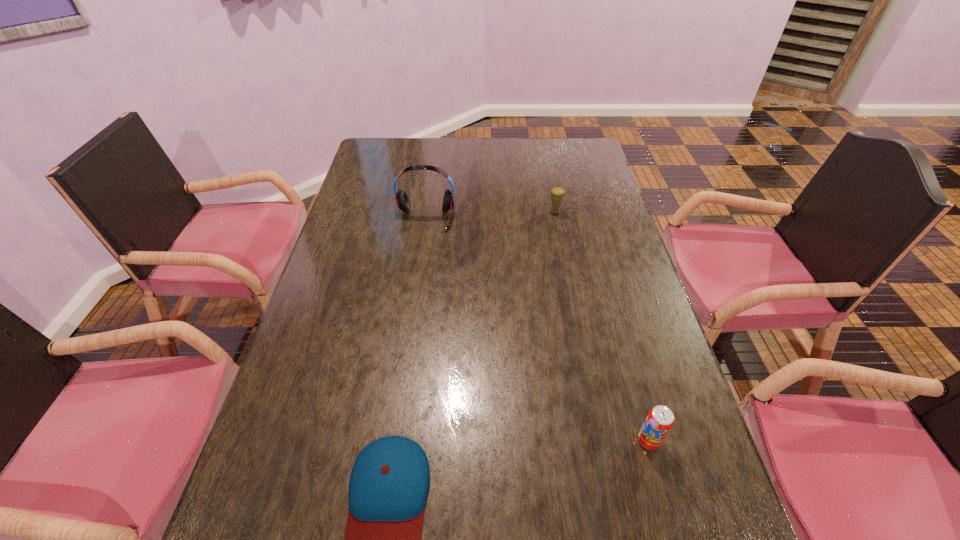
Locate an element on the screen. The width and height of the screenshot is (960, 540). headset is located at coordinates (402, 200).

Image resolution: width=960 pixels, height=540 pixels. I want to click on the third shortest object, so click(557, 193).

Find the location of `the second object from right to left`. the second object from right to left is located at coordinates (557, 193).

I want to click on soda can, so click(660, 419).

I want to click on the rightmost object, so click(x=660, y=419).

Identify the location of free spot located 0.320m with the microphone attached to the side of the tallest object. The image size is (960, 540). 412,310.

Where is `free spot located on the front of the straw for drinking`? Image resolution: width=960 pixels, height=540 pixels. free spot located on the front of the straw for drinking is located at coordinates (572, 300).

Identify the location of free region located on the left of the rightmost object. The height and width of the screenshot is (540, 960). (483, 441).

Image resolution: width=960 pixels, height=540 pixels. Find the location of `object at the right edge`. object at the right edge is located at coordinates (660, 419).

Locate an element on the screen. free space at the far edge is located at coordinates (492, 168).